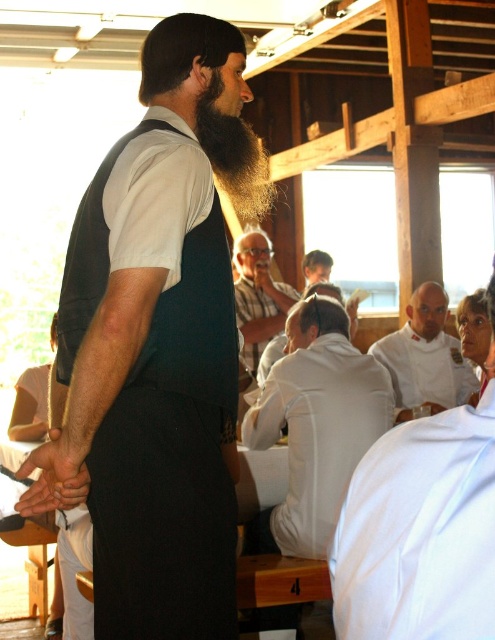
You are a tailor measuring clothes for a group of people in a communal dining area. You need to determine if the dark blue vest at center can fit over the striped cotton shirt at center without needing adjustments. Based on the description, can the vest accommodate the shirt?

The dark blue vest at center might be wider than striped cotton shirt at center, so there is a possibility that the vest can fit over the shirt without adjustments, but it depends on the exact measurements.

You are attending a community event and notice two clothing items at the center of the scene. The dark blue vest at center and the striped cotton shirt at center. Which clothing item appears to be larger in height?

The dark blue vest at center is taller than the striped cotton shirt at center, so the dark blue vest at center appears larger in height.